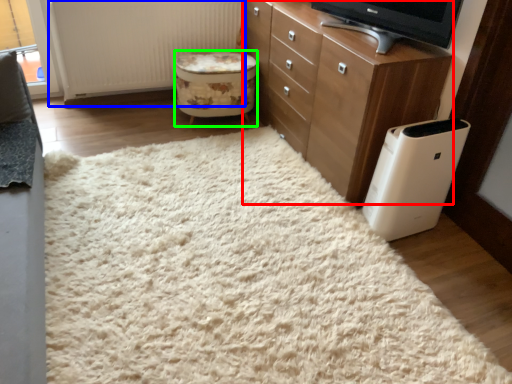
Question: Which object is the closest to the chest of drawers (highlighted by a red box)? Choose among these: radiator (highlighted by a blue box) or stool (highlighted by a green box).

Choices:
 (A) radiator
 (B) stool

Answer: (B)